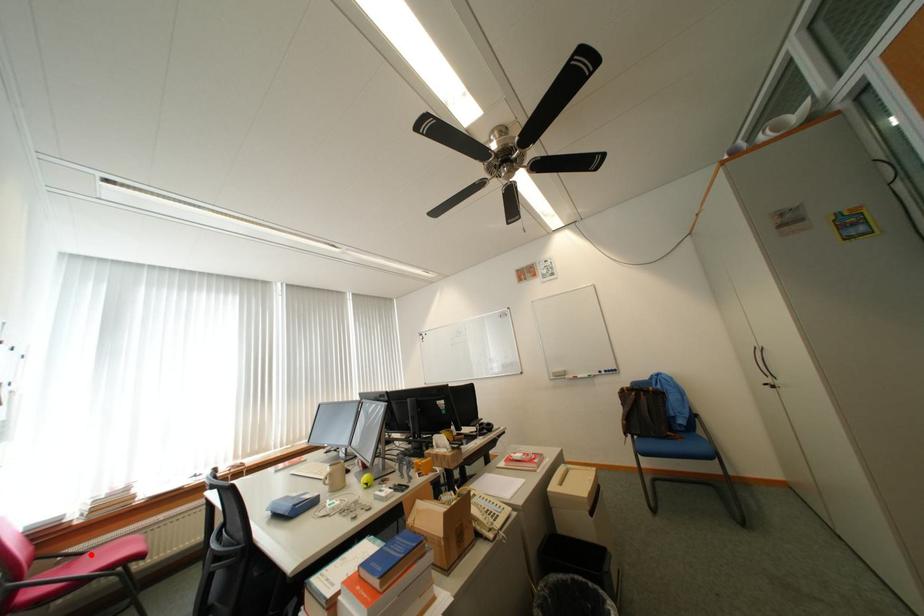
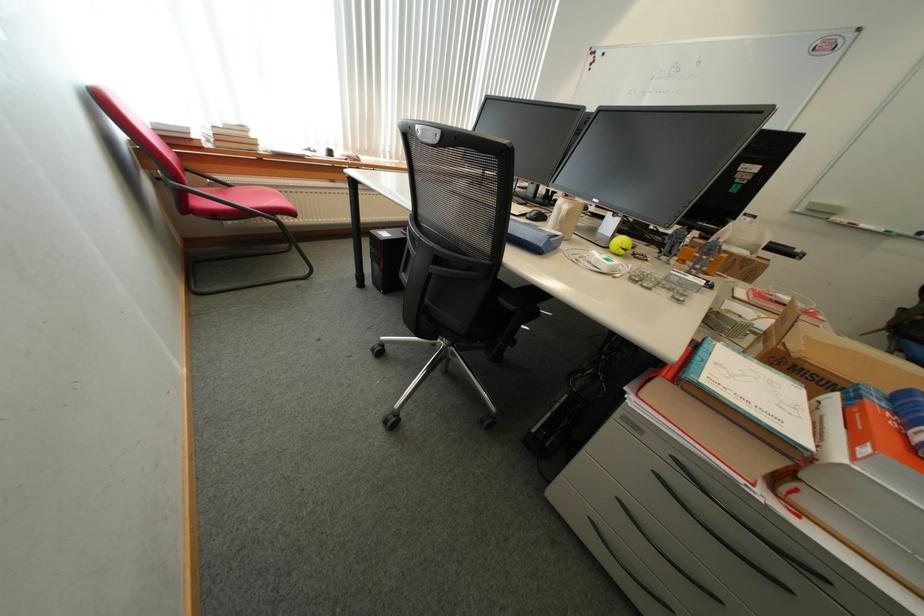
In the second image, find the point that corresponds to the highlighted location in the first image.

(237, 187)